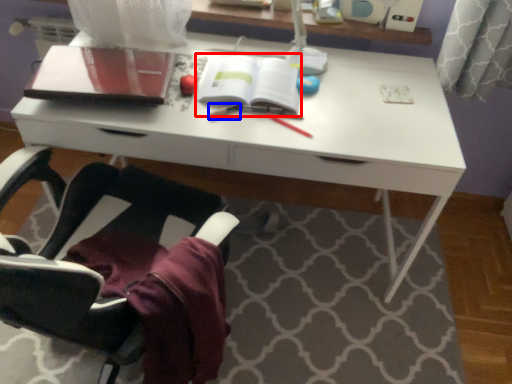
Question: Among these objects, which one is nearest to the camera, paperback book (highlighted by a red box) or stationery (highlighted by a blue box)?

Choices:
 (A) paperback book
 (B) stationery

Answer: (B)